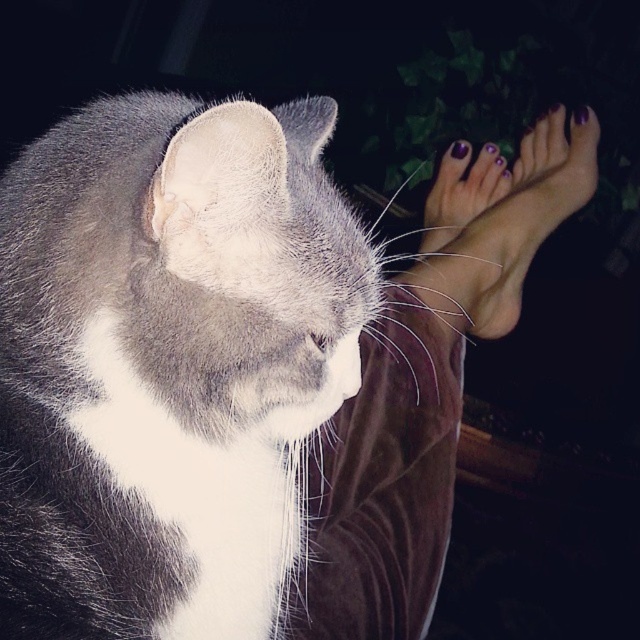
Is gray-white fur cat at center bigger than purple painted nails at upper right?

Correct, gray-white fur cat at center is larger in size than purple painted nails at upper right.

From the picture: Is gray-white fur cat at center to the right of purple painted nails at upper right from the viewer's perspective?

In fact, gray-white fur cat at center is to the left of purple painted nails at upper right.

Who is more distant from viewer, (99, 148) or (525, 202)?

The point (525, 202) is more distant.

This screenshot has height=640, width=640. In order to click on gray-white fur cat at center in this screenshot , I will do `click(172, 364)`.

Who is shorter, purple painted nails at upper right or purple nail polish toe at upper center?

Standing shorter between the two is purple nail polish toe at upper center.

Between point (541, 189) and point (506, 166), which one is positioned behind?

The point (506, 166) is behind.

I want to click on purple painted nails at upper right, so click(x=499, y=221).

The height and width of the screenshot is (640, 640). What do you see at coordinates (172, 364) in the screenshot? I see `gray-white fur cat at center` at bounding box center [172, 364].

Is gray-white fur cat at center below purple painted toe at upper right?

Correct, gray-white fur cat at center is located below purple painted toe at upper right.

The image size is (640, 640). Find the location of `gray-white fur cat at center`. gray-white fur cat at center is located at coordinates (172, 364).